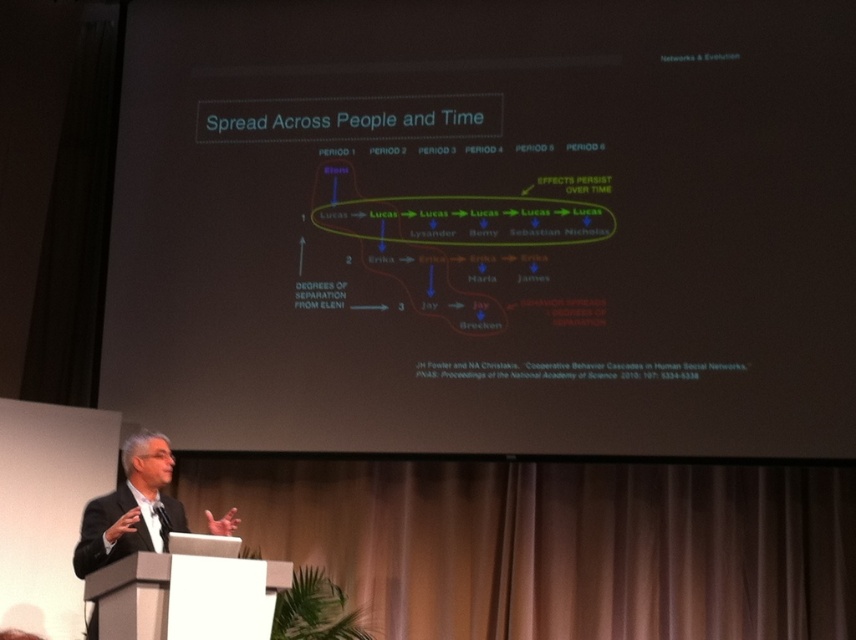
You are an attendee at the event and need to take a photo of the black matte projection screen at upper center. The event organizer requires that the photo must include the entire screen without any obstructions. Given that your camera has a fixed focal length and you are standing at the front row, can you estimate if the screen is positioned in a way that allows for a clear, unobstructed shot from your current viewpoint?

The black matte projection screen at upper center is located at point coordinates, so yes, it is positioned in a way that allows for a clear, unobstructed shot from the front row as there are no mentioned obstructions in the scene description.

You are an attendee at the event and want to take a photo of the black matte projection screen at upper center without the black suit at lower left blocking the view. Is this possible?

The black matte projection screen at upper center is further to the viewer than the black suit at lower left, so the black suit at lower left is closer to you. Therefore, the black suit at lower left may block the view of the black matte projection screen at upper center when taking a photo.